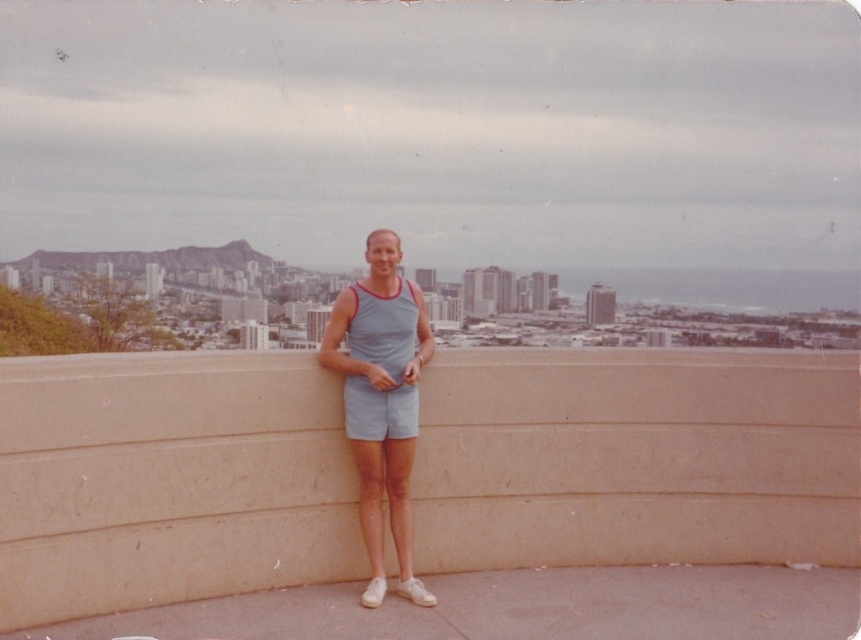
Question: Which of the following is the farthest from the observer?

Choices:
 (A) (362, 417)
 (B) (239, 566)

Answer: (A)

Question: Is beige concrete ledge at center bigger than gray fabric shorts at center?

Choices:
 (A) yes
 (B) no

Answer: (A)

Question: Which point is closer to the camera taking this photo?

Choices:
 (A) (112, 474)
 (B) (397, 500)

Answer: (A)

Question: Can you confirm if beige concrete ledge at center is positioned above gray fabric shorts at center?

Choices:
 (A) yes
 (B) no

Answer: (A)

Question: Considering the relative positions of beige concrete ledge at center and gray fabric shorts at center in the image provided, where is beige concrete ledge at center located with respect to gray fabric shorts at center?

Choices:
 (A) below
 (B) above

Answer: (B)